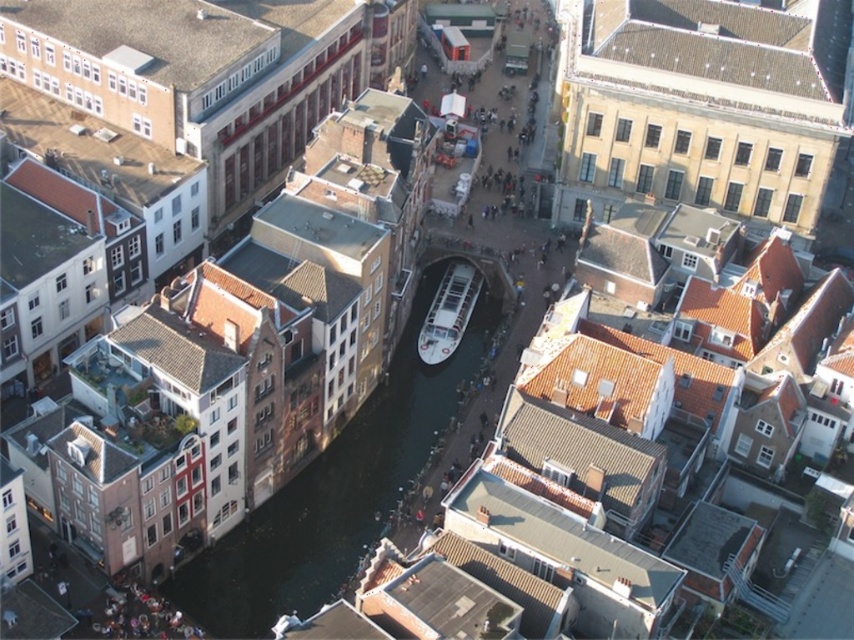
Based on the photo, you are a tourist planning to take a photo of the canal and the white glossy boat at center from the bridge above. The black smooth water at center is wider than the boat. To ensure the boat is centered in your photo, should you position your camera slightly to the left or right of the boat?

The black smooth water at center is wider than the white glossy boat at center, so to center the boat in the photo, position your camera directly above the boat since it is narrower and centered on the water.

You are a tourist standing on a bridge overlooking the canal. You notice the black smooth water at center and the white glossy boat at center. Which object is located to the left of the other?

The black smooth water at center is positioned on the left side of white glossy boat at center.

You are a tour guide explaining the canal city to visitors. You mention the black smooth water at center and the white glossy boat at center. How far apart are these two features?

The black smooth water at center is 9.20 meters from the white glossy boat at center.